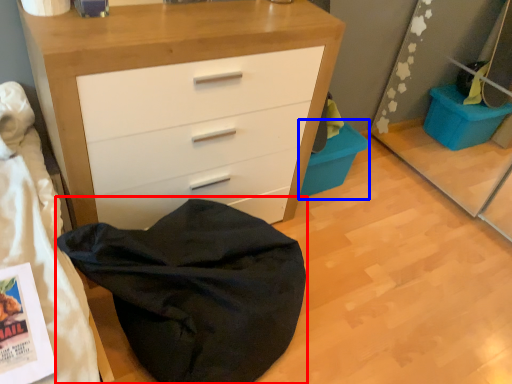
Question: Which point is further to the camera, bean bag chair (highlighted by a red box) or cabinetry (highlighted by a blue box)?

Choices:
 (A) bean bag chair
 (B) cabinetry

Answer: (B)